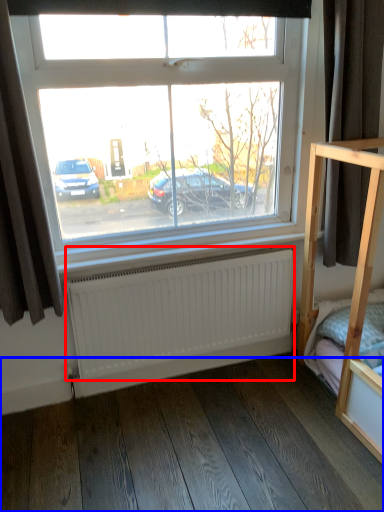
Question: Which object is closer to the camera taking this photo, radiator (highlighted by a red box) or hardwood (highlighted by a blue box)?

Choices:
 (A) radiator
 (B) hardwood

Answer: (B)